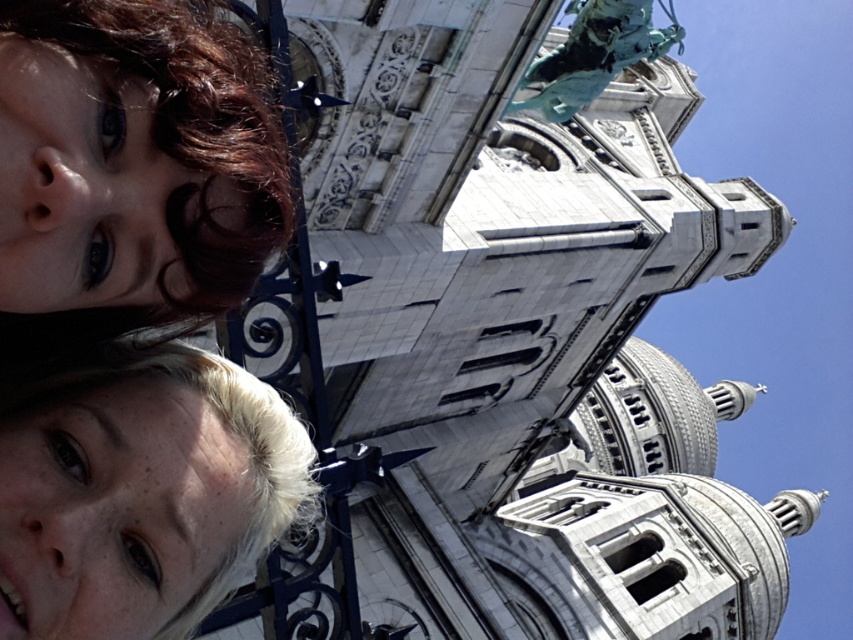
Question: Which of the following is the closest to the observer?

Choices:
 (A) (119, 170)
 (B) (277, 506)
 (C) (688, 561)

Answer: (A)

Question: Is white stone tower at upper center above blonde hair at lower left?

Choices:
 (A) no
 (B) yes

Answer: (A)

Question: Does white stone tower at upper center appear over matte brown hair at upper left?

Choices:
 (A) no
 (B) yes

Answer: (A)

Question: Which object is farther from the camera taking this photo?

Choices:
 (A) matte brown hair at upper left
 (B) blonde hair at lower left
 (C) white stone tower at upper center

Answer: (C)

Question: Can you confirm if white stone tower at upper center is bigger than matte brown hair at upper left?

Choices:
 (A) no
 (B) yes

Answer: (B)

Question: Which object is farther from the camera taking this photo?

Choices:
 (A) white stone tower at upper center
 (B) matte brown hair at upper left

Answer: (A)